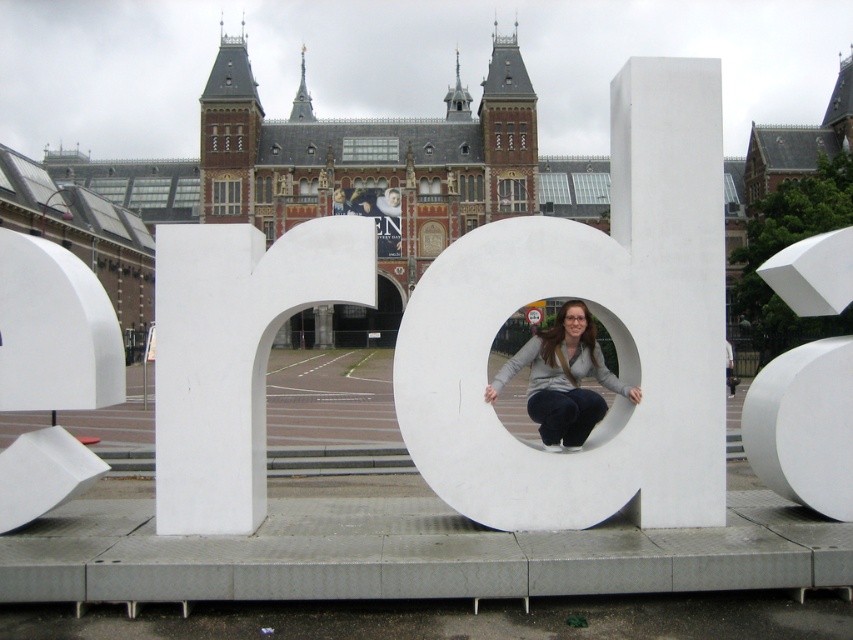
You are standing in front of the sculpture of Amsterdam letters and want to take a photo of both the white matte letter at center and the white matte sphere at right. Which object will appear larger in your photo?

The white matte letter at center will appear larger in the photo because it is closer to the viewer than the white matte sphere at right.